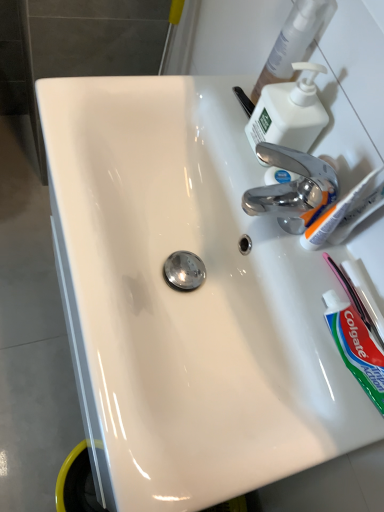
Question: Is white plastic toothbrush at upper right, the 1th toothbrush positioned from the left, closer to camera compared to pink plastic toothbrush at lower right, which is the first toothbrush from bottom to top?

Choices:
 (A) no
 (B) yes

Answer: (B)

Question: Are white plastic toothbrush at upper right, the 1th toothbrush positioned from the left, and pink plastic toothbrush at lower right, which is the first toothbrush from bottom to top, located far from each other?

Choices:
 (A) no
 (B) yes

Answer: (A)

Question: Considering the relative sizes of white plastic toothbrush at upper right, the 1th toothbrush positioned from the left, and pink plastic toothbrush at lower right, which is the first toothbrush from bottom to top, in the image provided, is white plastic toothbrush at upper right, the 1th toothbrush positioned from the left, wider than pink plastic toothbrush at lower right, which is the first toothbrush from bottom to top,?

Choices:
 (A) yes
 (B) no

Answer: (A)

Question: From a real-world perspective, is white plastic toothbrush at upper right, the 2th toothbrush positioned from the right, beneath pink plastic toothbrush at lower right, which appears as the 2th toothbrush when viewed from the left?

Choices:
 (A) yes
 (B) no

Answer: (B)

Question: Is white plastic toothbrush at upper right, the 2th toothbrush positioned from the right, positioned with its back to pink plastic toothbrush at lower right, the second toothbrush when ordered from top to bottom?

Choices:
 (A) no
 (B) yes

Answer: (A)

Question: Is white plastic toothbrush at upper right, the 1th toothbrush positioned from the left, to the left of pink plastic toothbrush at lower right, which is the first toothbrush from bottom to top, from the viewer's perspective?

Choices:
 (A) no
 (B) yes

Answer: (B)

Question: Is white plastic toothbrush at upper right, positioned as the 1th toothbrush in top-to-bottom order, turned away from green matte toothpaste at lower right?

Choices:
 (A) yes
 (B) no

Answer: (B)

Question: Is white plastic toothbrush at upper right, positioned as the 1th toothbrush in top-to-bottom order, to the left of green matte toothpaste at lower right from the viewer's perspective?

Choices:
 (A) no
 (B) yes

Answer: (B)

Question: Can you confirm if white plastic toothbrush at upper right, the 1th toothbrush positioned from the left, is shorter than green matte toothpaste at lower right?

Choices:
 (A) yes
 (B) no

Answer: (B)

Question: Does white plastic toothbrush at upper right, the 1th toothbrush positioned from the left, have a smaller size compared to green matte toothpaste at lower right?

Choices:
 (A) no
 (B) yes

Answer: (B)

Question: Could green matte toothpaste at lower right be considered to be inside white plastic toothbrush at upper right, the 2th toothbrush positioned from the right?

Choices:
 (A) yes
 (B) no

Answer: (B)

Question: Would you consider white plastic toothbrush at upper right, which is counted as the 2th toothbrush, starting from the bottom, to be distant from green matte toothpaste at lower right?

Choices:
 (A) no
 (B) yes

Answer: (A)

Question: Does pink plastic toothbrush at lower right, the second toothbrush when ordered from top to bottom, have a larger size compared to green matte toothpaste at lower right?

Choices:
 (A) yes
 (B) no

Answer: (B)